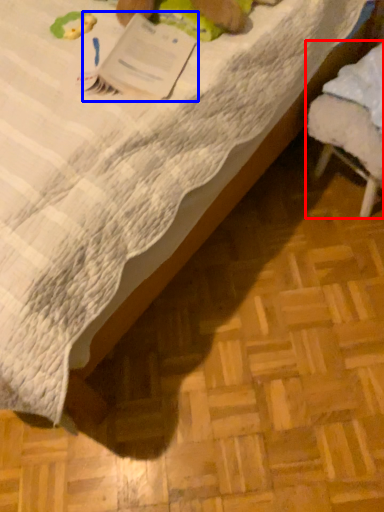
Question: Which point is closer to the camera, furniture (highlighted by a red box) or paperback book (highlighted by a blue box)?

Choices:
 (A) furniture
 (B) paperback book

Answer: (B)